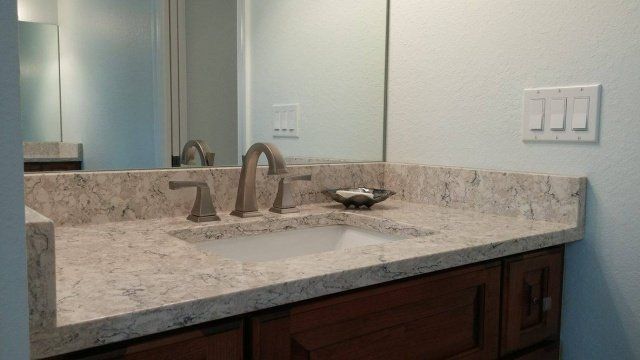
Image resolution: width=640 pixels, height=360 pixels. In order to click on sink water controls in this screenshot , I will do `click(203, 208)`, `click(280, 193)`.